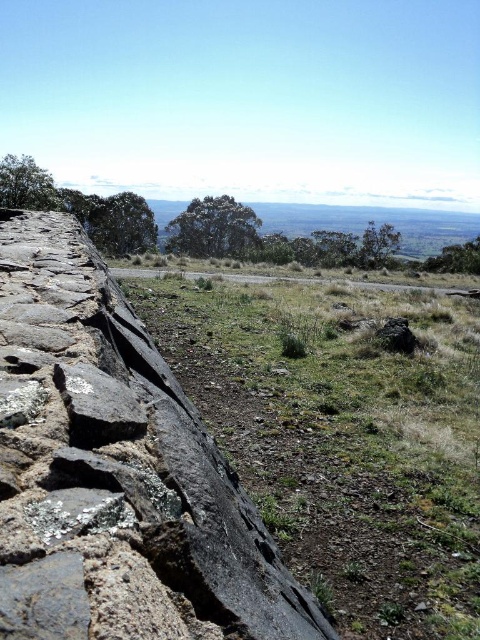
You are standing at the center of the image. Which direction should you walk to reach the dark gray stone wall at left?

You should walk to the left to reach the dark gray stone wall at left since it is located at point (x=116, y=470) which is to the left side of the image.

You are a hiker carrying a backpack and need to cross between the dark gray stone wall at left and the gray rock at center. The path between them is narrow. Can your 1.8 meter wide backpack fit through the gap?

The dark gray stone wall at left and gray rock at center are 2.50 meters apart from each other. Since the backpack is 1.8 meters wide, there is enough space for it to fit through the gap as 2.50 meters is wider than 1.8 meters.

You are standing at the point marked by the coordinates point (116, 470) in the image. What object are you facing?

The point (116, 470) corresponds to the dark gray stone wall at left, so you are facing the dark gray stone wall at left.